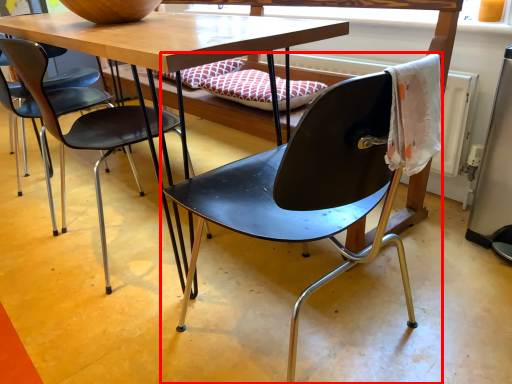
Question: In this image, where is chair (annotated by the red box) located relative to chair?

Choices:
 (A) left
 (B) right

Answer: (B)